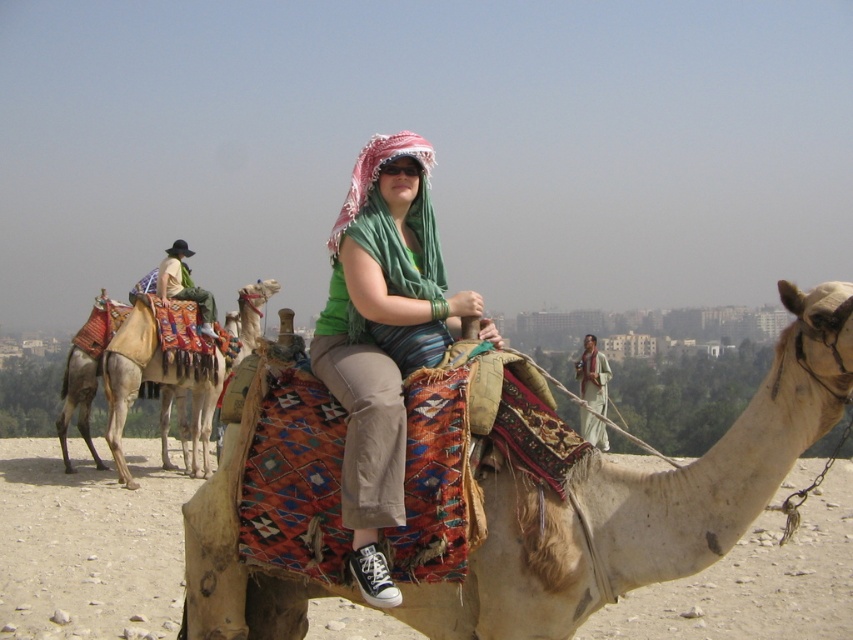
You are a photographer standing at the center of the scene. You want to take a photo of the beige textured camel at left and the green fabric headscarf at center. If your camera has a maximum focus range of 10 meters, will both subjects be in focus?

The beige textured camel at left is 9.40 meters away from the green fabric headscarf at center. Since the camera can focus up to 10 meters, both subjects are within the focus range and will be in focus.

You are a photographer trying to capture the camel rider in the foreground. You notice two points marked in the image at coordinates point (x=244, y=355) and point (x=585, y=369). Which point should you focus on to ensure the foreground rider is in sharp focus?

Point (x=244, y=355) is closer to the camera than point (x=585, y=369), so focusing on point (x=244, y=355) will ensure the foreground rider is in sharp focus.

You are a photographer trying to capture the camel rider in the desert. You notice the beige textured camel at center and the green fabric headscarf at center. Which object is positioned closer to your camera lens?

The beige textured camel at center is closer to the viewer than the green fabric headscarf at center, so the camel would appear closer to the camera lens.